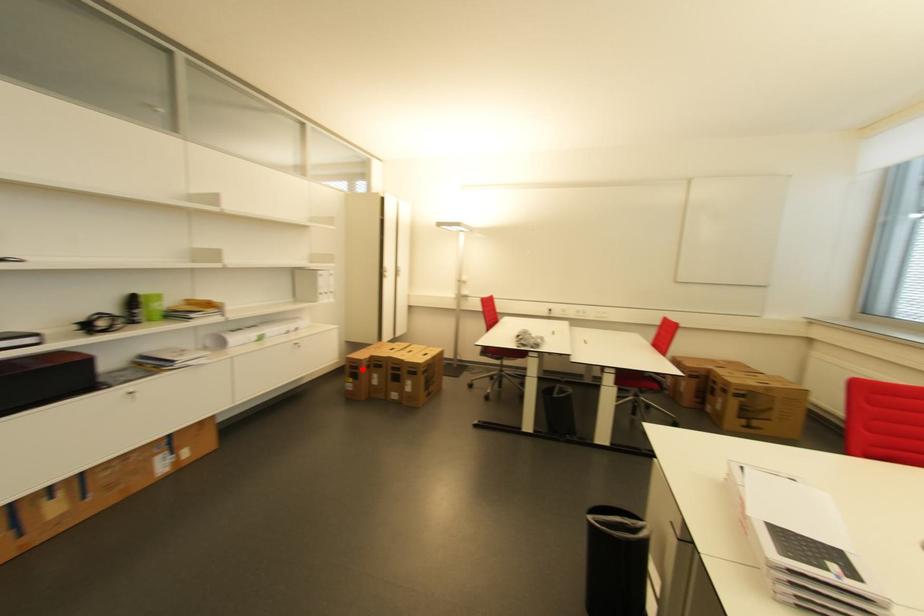
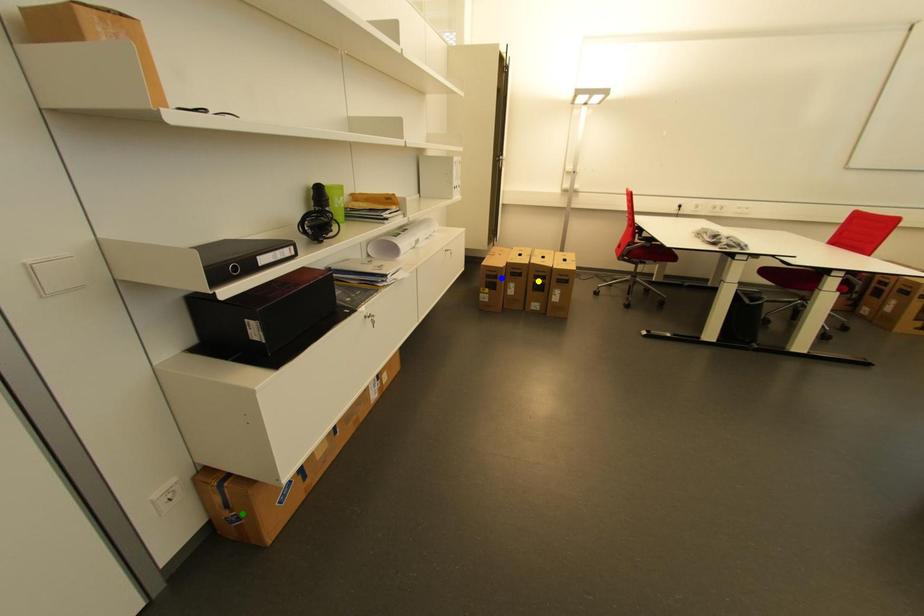
Question: I am providing you with two images of the same scene from different viewpoints. A red point is marked on the first image. You are given multiple points on the second image. Can you choose the point in image 2 that corresponds to the point in image 1?

Choices:
 (A) yellow point
 (B) green point
 (C) blue point

Answer: (C)